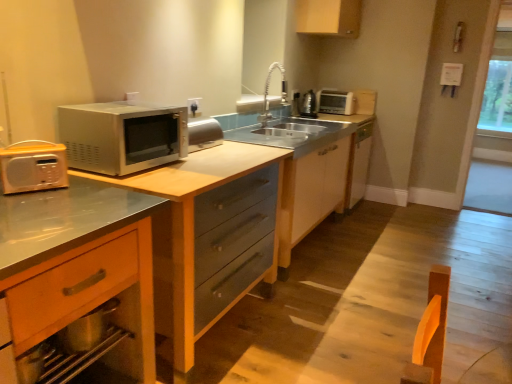
What are the coordinates of `vacant area that is situated to the right of satin silver microwave at left` in the screenshot? It's located at (208, 162).